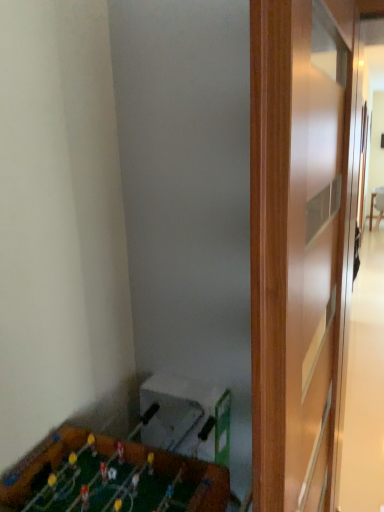
Question: From the image's perspective, is wooden table at right above or below wooden foosball table at lower left?

Choices:
 (A) below
 (B) above

Answer: (B)

Question: In the image, is wooden table at right positioned in front of or behind wooden foosball table at lower left?

Choices:
 (A) behind
 (B) front

Answer: (A)

Question: Which is correct: wooden table at right is inside wooden foosball table at lower left, or outside of it?

Choices:
 (A) outside
 (B) inside

Answer: (A)

Question: From a real-world perspective, is wooden foosball table at lower left above or below wooden table at right?

Choices:
 (A) above
 (B) below

Answer: (A)

Question: From their relative heights in the image, would you say wooden foosball table at lower left is taller or shorter than wooden table at right?

Choices:
 (A) short
 (B) tall

Answer: (A)

Question: In the image, is wooden foosball table at lower left on the left side or the right side of wooden table at right?

Choices:
 (A) right
 (B) left

Answer: (B)

Question: Is wooden foosball table at lower left in front of or behind wooden table at right in the image?

Choices:
 (A) front
 (B) behind

Answer: (A)